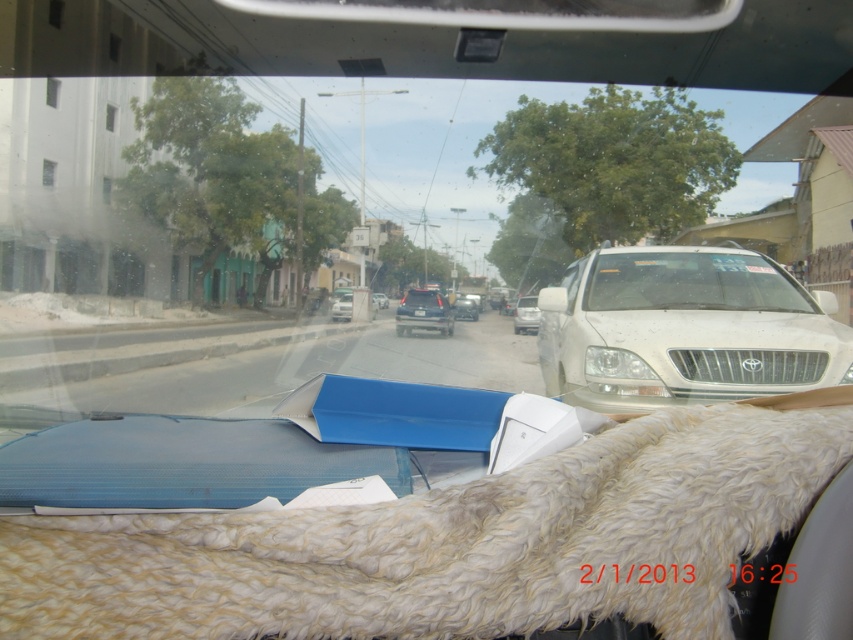
You are a passenger in a car and looking at the satin blue sedan at center and the black plastic license plate at center through the windshield. Which object is nearer to you?

The satin blue sedan at center is closer to the viewer than the black plastic license plate at center.

You are a passenger in a car and want to look at the road ahead. Which object, the clear glass windshield at center or the satin black sedan at center, should you look through to see the road?

You should look through the clear glass windshield at center to see the road ahead, as it is in front of the satin black sedan at center and provides an unobstructed view.

You are sitting in the driver seat of the vehicle and see two points marked on the windshield. The first point is at coordinate point(x=405, y=308) and the second point is at coordinate point(x=341, y=307). Which point is closer to your eyes?

Point(x=405, y=308) is closer to the viewer than point(x=341, y=307).